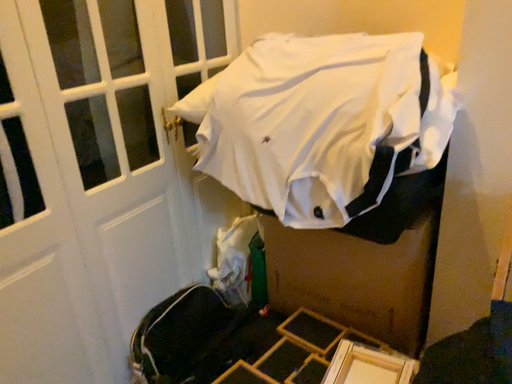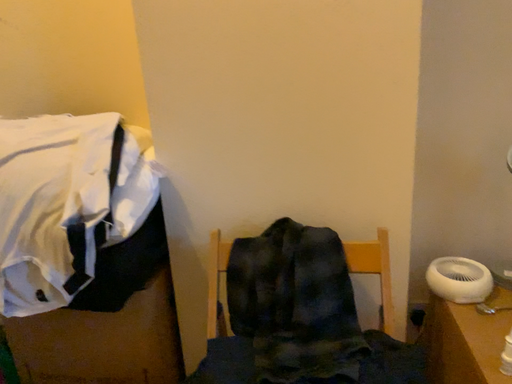
Question: Which way did the camera rotate in the video?

Choices:
 (A) rotated upward
 (B) rotated downward

Answer: (A)